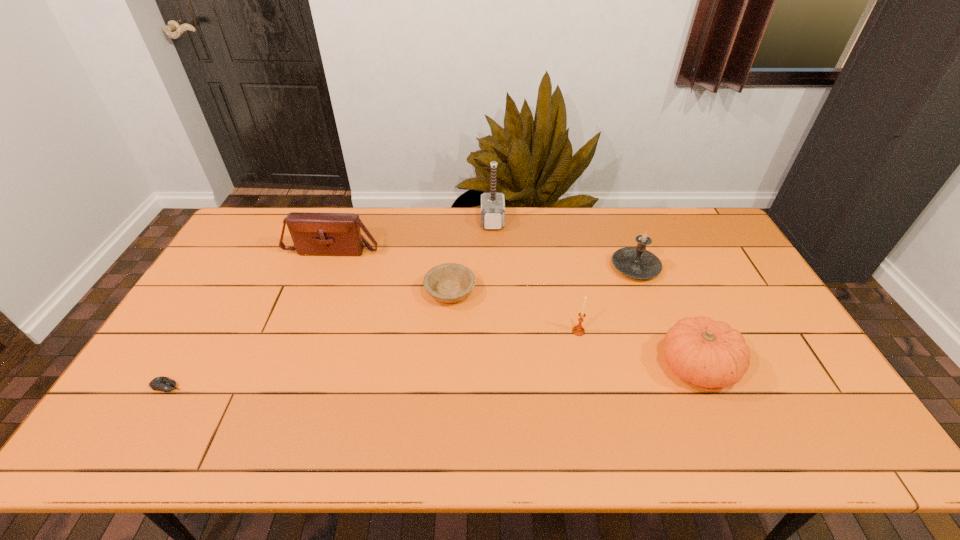
Locate an element on the screen. The width and height of the screenshot is (960, 540). the fourth object from right to left is located at coordinates (492, 204).

The image size is (960, 540). Identify the location of the tallest object. (492, 204).

Where is `the sixth object from right to left`? The image size is (960, 540). the sixth object from right to left is located at coordinates (322, 234).

At what (x,y) coordinates should I click in order to perform the action: click on candle. Please return your answer as a coordinate pair (x, y). Looking at the image, I should click on pyautogui.click(x=636, y=262).

This screenshot has height=540, width=960. In order to click on the fifth object from left to right in this screenshot , I will do `click(578, 330)`.

You are a GUI agent. You are given a task and a screenshot of the screen. Output one action in this format:
    pyautogui.click(x=<x>, y=<y>)
    Task: Click on the candle_holder
    The width and height of the screenshot is (960, 540).
    Given the screenshot: What is the action you would take?
    pyautogui.click(x=578, y=330)

At what (x,y) coordinates should I click in order to perform the action: click on pumpkin. Please return your answer as a coordinate pair (x, y). Looking at the image, I should click on (707, 353).

Where is `bowl`? bowl is located at coordinates (450, 282).

Identify the location of the fifth object from right to left. (450, 282).

Where is `the shortest object`? the shortest object is located at coordinates (161, 383).